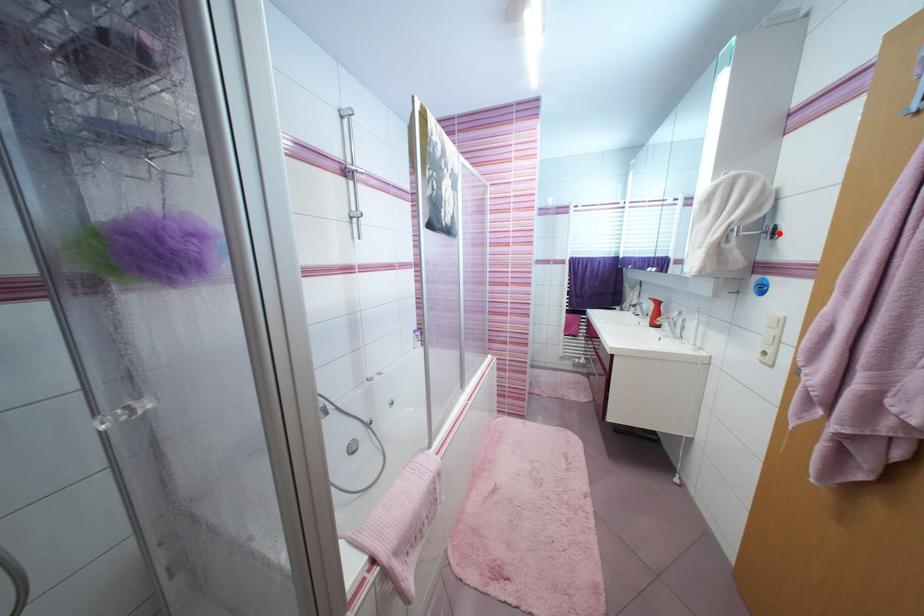
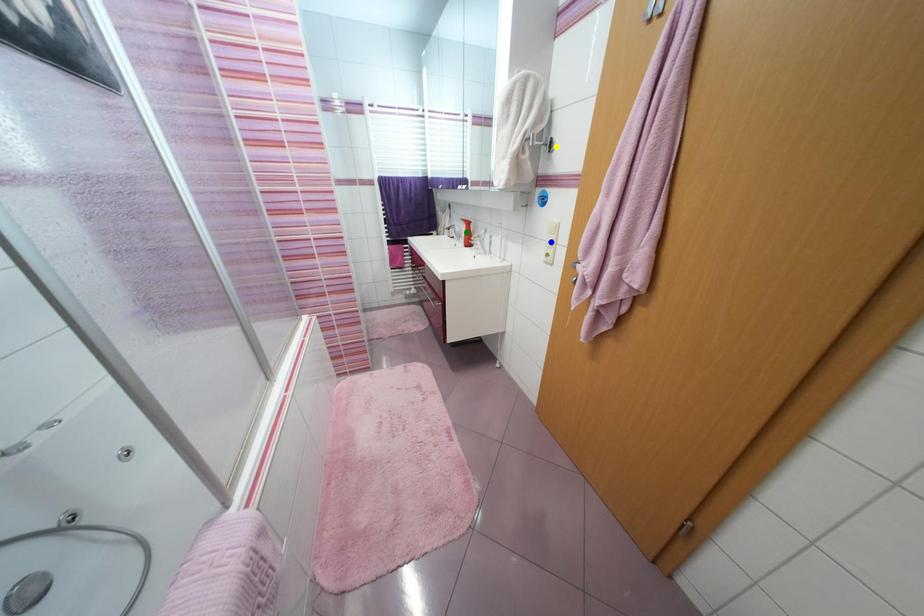
Question: I am providing you with two images of the same scene from different viewpoints. A red point is marked on the first image. You are given multiple points on the second image. Which point in image 2 is actually the same real-world point as the red point in image 1?

Choices:
 (A) green point
 (B) yellow point
 (C) blue point

Answer: (B)